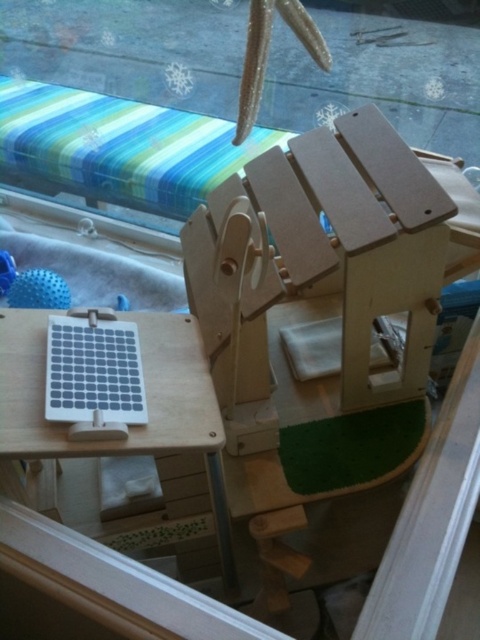
Image resolution: width=480 pixels, height=640 pixels. What do you see at coordinates (132, 428) in the screenshot?
I see `wooden table at lower left` at bounding box center [132, 428].

Does wooden table at lower left have a lesser width compared to light brown wood beach chair at center?

No.

Between point (116, 444) and point (241, 298), which one is positioned behind?

The point (241, 298) is more distant.

Where is `wooden table at lower left`? This screenshot has height=640, width=480. wooden table at lower left is located at coordinates (132, 428).

Is light brown wood beach chair at center bigger than white matte solar panel at lower left?

Indeed, light brown wood beach chair at center has a larger size compared to white matte solar panel at lower left.

Between light brown wood beach chair at center and white matte solar panel at lower left, which one appears on the right side from the viewer's perspective?

From the viewer's perspective, light brown wood beach chair at center appears more on the right side.

Is point (264, 445) positioned in front of point (93, 388)?

No, it is behind (93, 388).

Identify the location of light brown wood beach chair at center. (235, 308).

In the scene shown: Does wooden table at lower left have a greater height compared to white matte solar panel at lower left?

Yes.

Is wooden table at lower left thinner than white matte solar panel at lower left?

No, wooden table at lower left is not thinner than white matte solar panel at lower left.

Where is `wooden table at lower left`? wooden table at lower left is located at coordinates (132, 428).

Find the location of a particular element. The image size is (480, 640). wooden table at lower left is located at coordinates tap(132, 428).